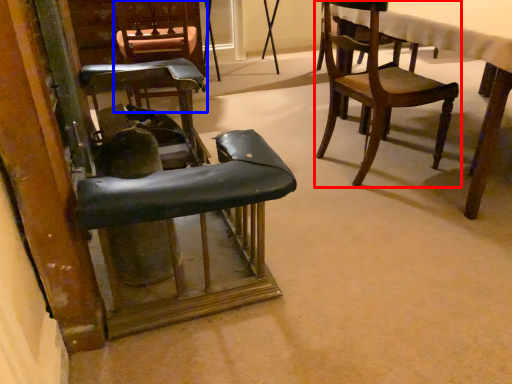
Question: Among these objects, which one is farthest to the camera, chair (highlighted by a red box) or chair (highlighted by a blue box)?

Choices:
 (A) chair
 (B) chair

Answer: (B)